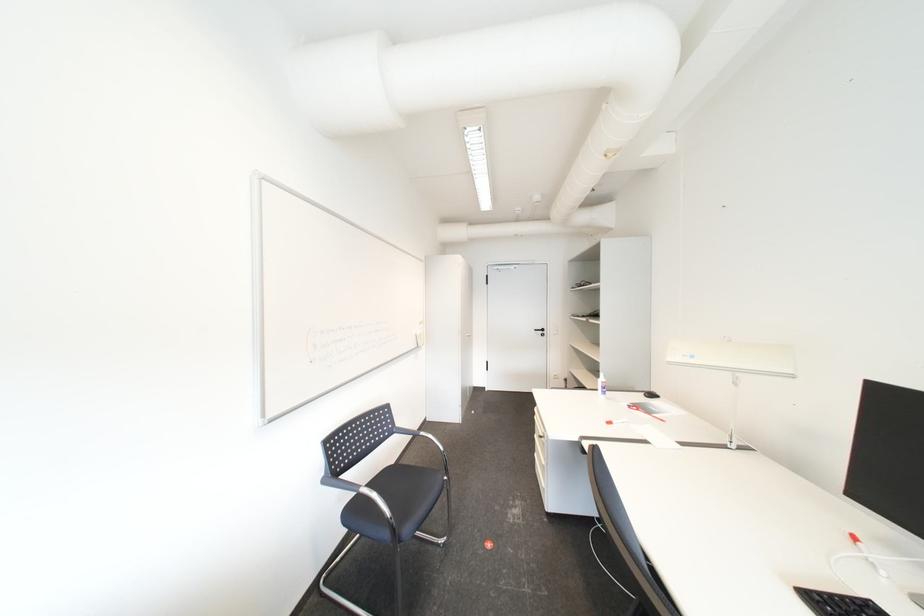
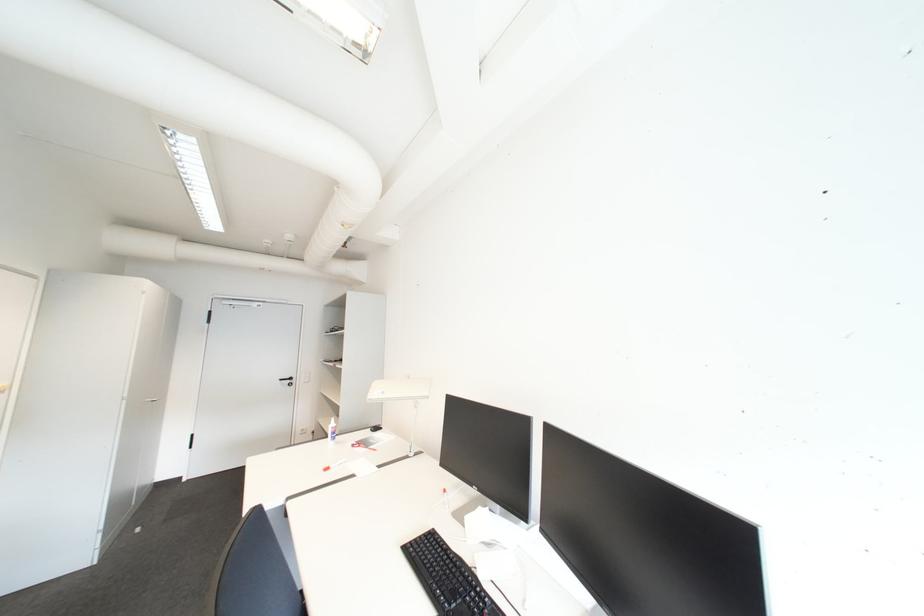
Question: Based on the continuous images, in which direction is the camera rotating? Reply with the corresponding letter.

Choices:
 (A) Left
 (B) Right
 (C) Up
 (D) Down

Answer: (B)